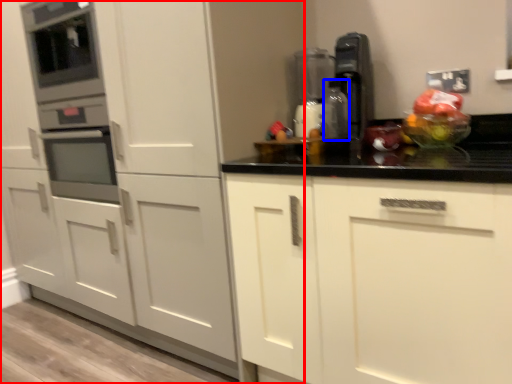
Question: Which object is closer to the camera taking this photo, cabinetry (highlighted by a red box) or bottle (highlighted by a blue box)?

Choices:
 (A) cabinetry
 (B) bottle

Answer: (A)